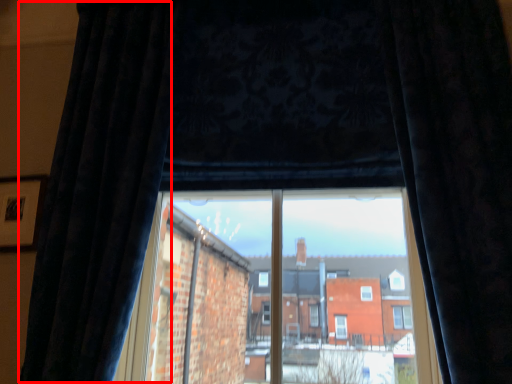
Question: In this image, where is curtain (annotated by the red box) located relative to curtain?

Choices:
 (A) left
 (B) right

Answer: (A)